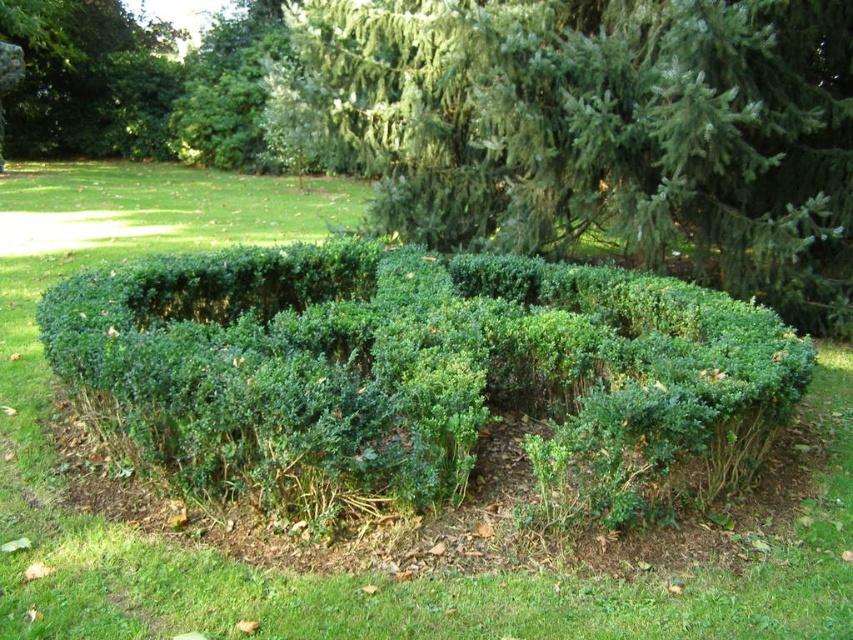
Does green leafy tree at center come behind green leafy bush at upper left?

No.

Which is in front, point (532, 120) or point (113, 3)?

Point (532, 120)

Locate an element on the screen. The image size is (853, 640). green leafy tree at center is located at coordinates (604, 131).

Which is in front, point (650, 307) or point (512, 97)?

Point (650, 307) is more forward.

Does point (569, 298) come behind point (431, 188)?

That is False.

Locate an element on the screen. This screenshot has width=853, height=640. green leafy hedge at center is located at coordinates (421, 376).

I want to click on green leafy hedge at center, so [421, 376].

Does green leafy hedge at center have a larger size compared to green leafy bush at upper left?

No, green leafy hedge at center is not bigger than green leafy bush at upper left.

Does point (202, 321) come in front of point (20, 22)?

Yes, point (202, 321) is closer to viewer.

Locate an element on the screen. green leafy hedge at center is located at coordinates (421, 376).